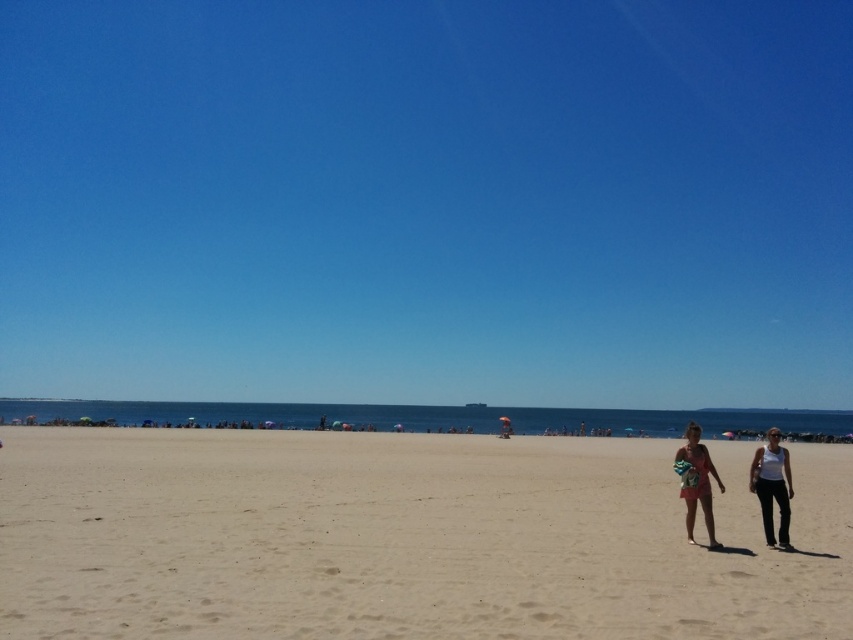
You are a photographer positioned at the center of the beach scene. You need to capture a shot that includes both the white cotton tank top at lower right and the white matte tank top at right. Which one will appear higher in the frame?

The white cotton tank top at lower right is located above the white matte tank top at right, so it will appear higher in the frame.

You are a drone operator tasked with capturing aerial footage of the beach scene. The beige sand at center is your primary focus. Based on its coordinates, would you position the camera to the north or south to ensure it remains centered in the frame?

The beige sand at center is located at point (x=403, y=538), which means it is positioned slightly to the right and lower part of the image. To keep it centered, the camera should be adjusted to the north to balance its position within the frame.

Looking at the beach scene, where is the white matte tank top at right compared to the beige cotton dress at lower right?

The white matte tank top at right is positioned to the right of the beige cotton dress at lower right.